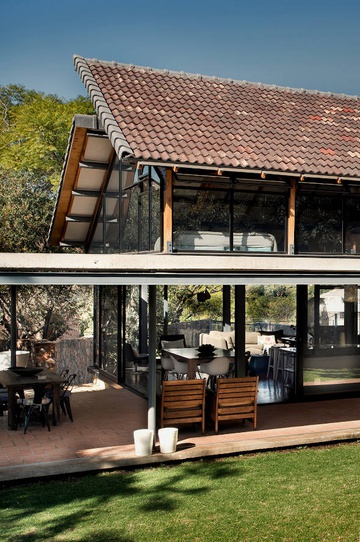
Locate an element on the screen. sofa is located at coordinates (253, 338).